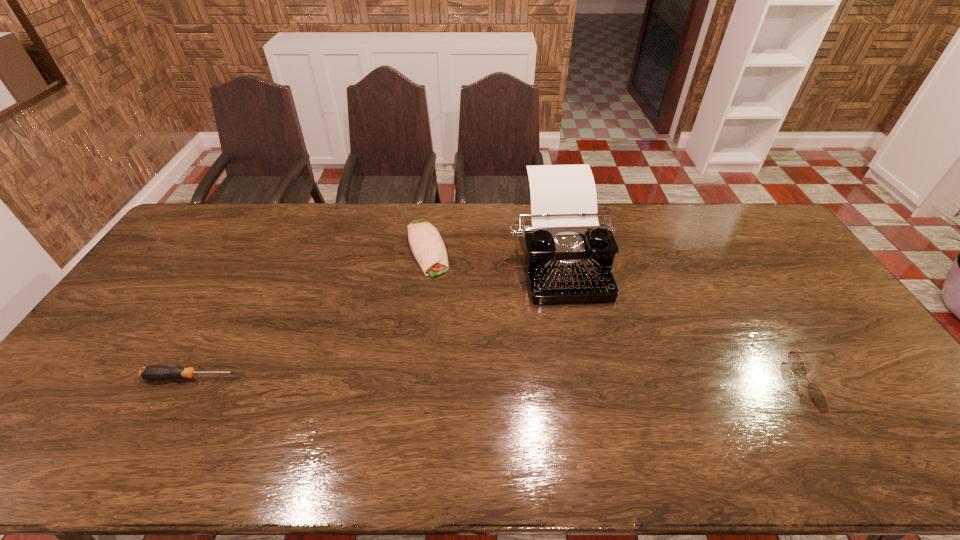
Image resolution: width=960 pixels, height=540 pixels. Identify the location of free space located on the face of the rightmost object. (682, 387).

You are a GUI agent. You are given a task and a screenshot of the screen. Output one action in this format:
    pyautogui.click(x=<x>, y=<y>)
    Task: Click on the free spot located at the bitten end of the third object from right to left
    The width and height of the screenshot is (960, 540).
    Given the screenshot: What is the action you would take?
    pyautogui.click(x=435, y=288)

Image resolution: width=960 pixels, height=540 pixels. Identify the location of vacant space located 0.360m at the bitten end of the third object from right to left. (464, 366).

The width and height of the screenshot is (960, 540). I want to click on vacant area situated at the bitten end of the third object from right to left, so click(x=450, y=330).

You are a GUI agent. You are given a task and a screenshot of the screen. Output one action in this format:
    pyautogui.click(x=<x>, y=<y>)
    Task: Click on the free space located 0.380m on the keys of the typewriter
    Image resolution: width=960 pixels, height=540 pixels.
    Given the screenshot: What is the action you would take?
    tap(601, 423)

Find the location of a particular element. free region located 0.360m on the keys of the typewriter is located at coordinates (599, 415).

At what (x,y) coordinates should I click in order to perform the action: click on free space located 0.080m on the keys of the typewriter. Please return your answer as a coordinate pair (x, y). The width and height of the screenshot is (960, 540). Looking at the image, I should click on (576, 326).

Identify the location of burrito at the far edge. (428, 248).

I want to click on typewriter that is at the far edge, so click(x=569, y=255).

The image size is (960, 540). What are the coordinates of `object that is at the near edge` in the screenshot? It's located at (816, 395).